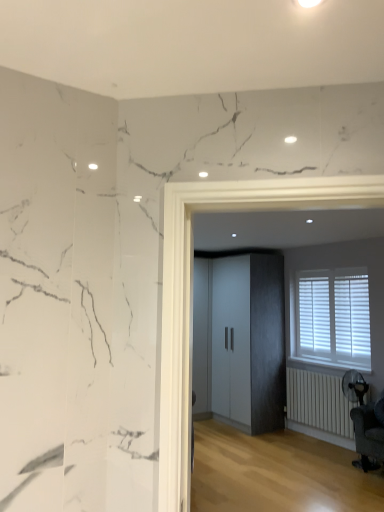
Question: Is white matte radiator at lower right to the left of white wood blinds at right from the viewer's perspective?

Choices:
 (A) yes
 (B) no

Answer: (A)

Question: Is white wood blinds at right at the back of white matte radiator at lower right?

Choices:
 (A) no
 (B) yes

Answer: (A)

Question: Is white matte radiator at lower right positioned beyond the bounds of white wood blinds at right?

Choices:
 (A) yes
 (B) no

Answer: (A)

Question: Would you say white matte radiator at lower right contains white wood blinds at right?

Choices:
 (A) yes
 (B) no

Answer: (B)

Question: Is white matte radiator at lower right next to white wood blinds at right?

Choices:
 (A) no
 (B) yes

Answer: (A)

Question: In terms of height, does white matte radiator at lower right look taller or shorter compared to matte gray cabinet at center?

Choices:
 (A) short
 (B) tall

Answer: (A)

Question: From the image's perspective, is white matte radiator at lower right positioned above or below matte gray cabinet at center?

Choices:
 (A) below
 (B) above

Answer: (A)

Question: Is white matte radiator at lower right to the left or to the right of matte gray cabinet at center in the image?

Choices:
 (A) right
 (B) left

Answer: (A)

Question: Relative to matte gray cabinet at center, is white matte radiator at lower right in front or behind?

Choices:
 (A) front
 (B) behind

Answer: (A)

Question: Is white matte radiator at lower right situated inside dark gray fabric swivel chair at lower right or outside?

Choices:
 (A) inside
 (B) outside

Answer: (B)

Question: From the image's perspective, is white matte radiator at lower right above or below dark gray fabric swivel chair at lower right?

Choices:
 (A) below
 (B) above

Answer: (A)

Question: In terms of size, does white matte radiator at lower right appear bigger or smaller than dark gray fabric swivel chair at lower right?

Choices:
 (A) big
 (B) small

Answer: (B)

Question: Is point (307, 384) closer or farther from the camera than point (359, 426)?

Choices:
 (A) closer
 (B) farther

Answer: (B)

Question: From the image's perspective, is matte gray cabinet at center located above or below white matte radiator at lower right?

Choices:
 (A) above
 (B) below

Answer: (A)

Question: In terms of width, does matte gray cabinet at center look wider or thinner when compared to white matte radiator at lower right?

Choices:
 (A) thin
 (B) wide

Answer: (B)